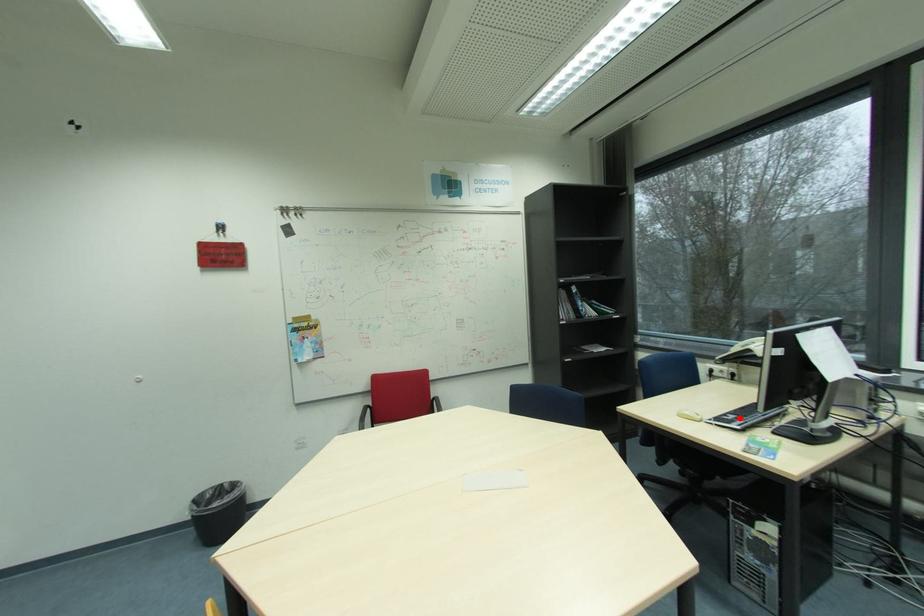
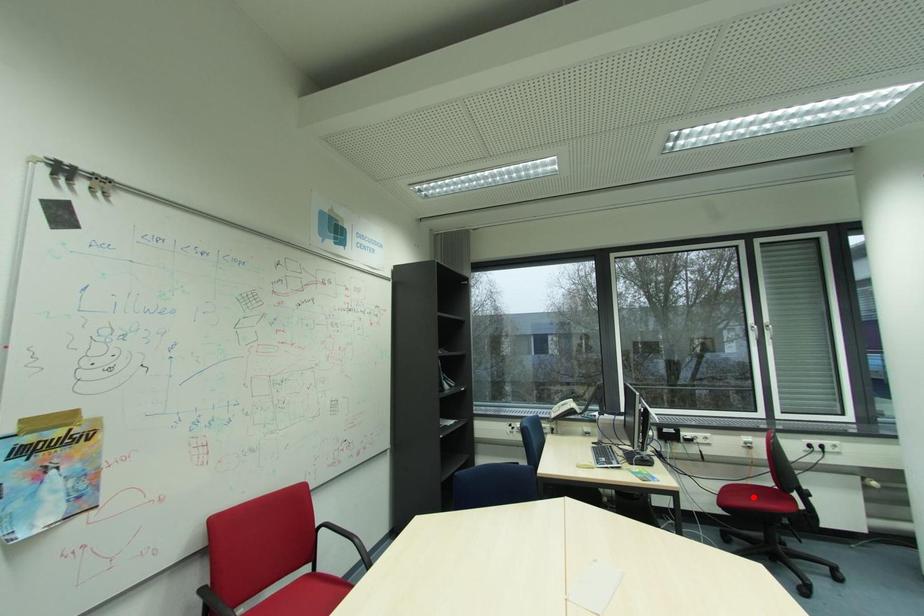
I am providing you with two images of the same scene from different viewpoints. A red point is marked on the first image and another point is marked on the second image. Do the highlighted points in image1 and image2 indicate the same real-world spot?

No